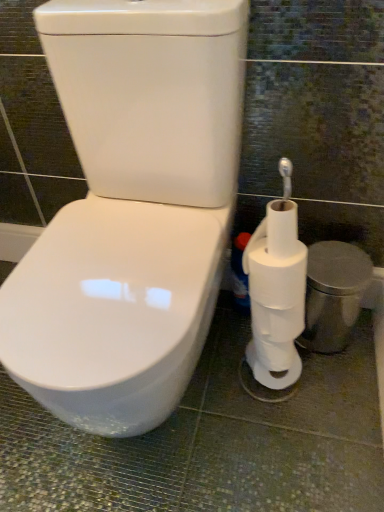
Question: From a real-world perspective, does white matte toilet paper at right sit lower than white plastic bottle at lower right?

Choices:
 (A) yes
 (B) no

Answer: (B)

Question: Considering the relative sizes of white matte toilet paper at right and white plastic bottle at lower right in the image provided, is white matte toilet paper at right bigger than white plastic bottle at lower right?

Choices:
 (A) yes
 (B) no

Answer: (A)

Question: Does white matte toilet paper at right come behind white plastic bottle at lower right?

Choices:
 (A) no
 (B) yes

Answer: (A)

Question: Does white matte toilet paper at right have a lesser width compared to white plastic bottle at lower right?

Choices:
 (A) yes
 (B) no

Answer: (B)

Question: Is white plastic bottle at lower right at the back of white matte toilet paper at right?

Choices:
 (A) no
 (B) yes

Answer: (A)

Question: From the image's perspective, does white matte toilet paper at right appear lower than white plastic bottle at lower right?

Choices:
 (A) no
 (B) yes

Answer: (A)

Question: Considering the relative positions of white plastic bottle at lower right and white matte toilet paper at right in the image provided, is white plastic bottle at lower right in front of white matte toilet paper at right?

Choices:
 (A) yes
 (B) no

Answer: (B)

Question: From the image's perspective, is white plastic bottle at lower right on top of white matte toilet paper at right?

Choices:
 (A) no
 (B) yes

Answer: (A)

Question: From a real-world perspective, is white plastic bottle at lower right located beneath white matte toilet paper at right?

Choices:
 (A) yes
 (B) no

Answer: (A)

Question: Considering the relative sizes of white plastic bottle at lower right and white matte toilet paper at right in the image provided, is white plastic bottle at lower right bigger than white matte toilet paper at right?

Choices:
 (A) yes
 (B) no

Answer: (B)

Question: Considering the relative sizes of white plastic bottle at lower right and white matte toilet paper at right in the image provided, is white plastic bottle at lower right thinner than white matte toilet paper at right?

Choices:
 (A) no
 (B) yes

Answer: (B)

Question: Is white plastic bottle at lower right at the left side of white matte toilet paper at right?

Choices:
 (A) no
 (B) yes

Answer: (B)

Question: In terms of size, does white plastic bottle at lower right appear bigger or smaller than white matte toilet paper at right?

Choices:
 (A) big
 (B) small

Answer: (B)